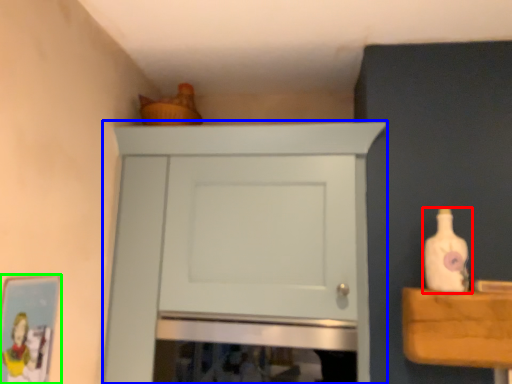
Question: Which is farther away from bottle (highlighted by a red box)? cupboard (highlighted by a blue box) or picture frame (highlighted by a green box)?

Choices:
 (A) cupboard
 (B) picture frame

Answer: (B)